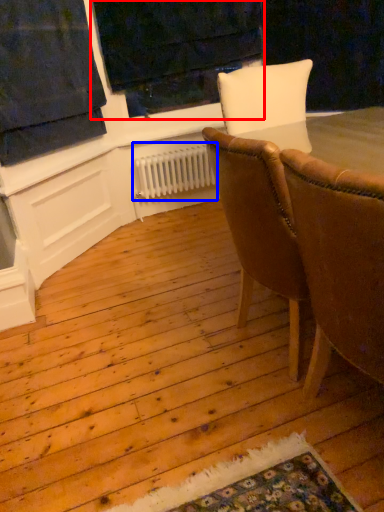
Question: Which point is closer to the camera, window frame (highlighted by a red box) or radiator (highlighted by a blue box)?

Choices:
 (A) window frame
 (B) radiator

Answer: (A)